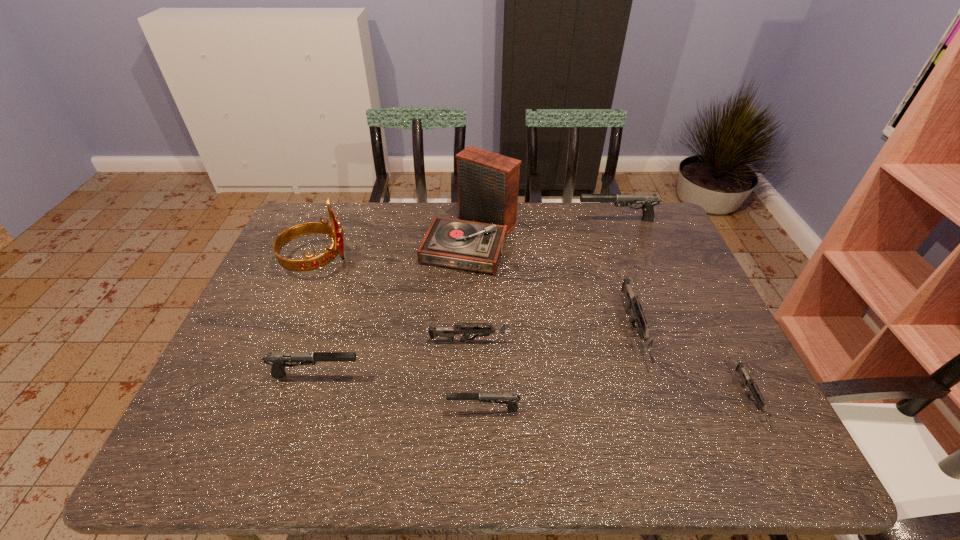
I want to click on free space located 0.260m at the muzzle end of the smallest gray gun, so click(330, 410).

Where is `free space located at the muzzle end of the smallest gray gun`? The height and width of the screenshot is (540, 960). free space located at the muzzle end of the smallest gray gun is located at coordinates (334, 410).

Where is `vacant region located at the muzzle end of the smallest gray gun`? The width and height of the screenshot is (960, 540). vacant region located at the muzzle end of the smallest gray gun is located at coordinates (276, 410).

What are the coordinates of `phonograph record situated at the far edge` in the screenshot? It's located at (488, 183).

You are a GUI agent. You are given a task and a screenshot of the screen. Output one action in this format:
    pyautogui.click(x=<x>, y=<y>)
    Task: Click on the tiara that is at the far edge
    The image size is (960, 540).
    Given the screenshot: What is the action you would take?
    pyautogui.click(x=334, y=231)

You are a GUI agent. You are given a task and a screenshot of the screen. Output one action in this format:
    pyautogui.click(x=<x>, y=<y>)
    Task: Click on the gun located in the far edge section of the desktop
    
    Given the screenshot: What is the action you would take?
    pyautogui.click(x=649, y=201)

At what (x,y) coordinates should I click in order to perform the action: click on object that is at the near edge. Please return your answer as a coordinate pair (x, y). The image size is (960, 540). Looking at the image, I should click on (746, 380).

The height and width of the screenshot is (540, 960). Find the location of `tiara present at the left edge`. tiara present at the left edge is located at coordinates (334, 231).

Find the location of a particular element. gun located at the left edge is located at coordinates (277, 360).

This screenshot has width=960, height=540. I want to click on object at the far left corner, so 334,231.